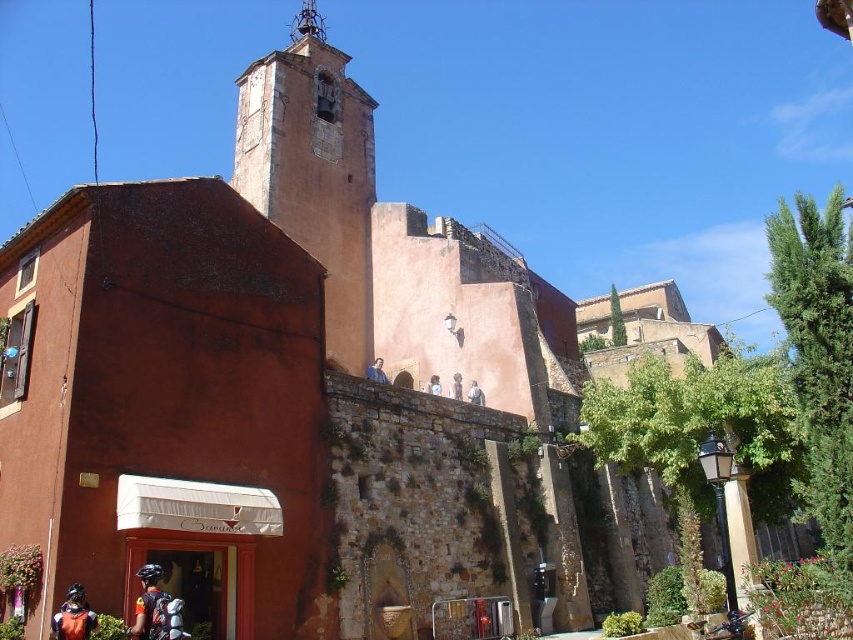
Based on the photo, you are standing at the entrance of the historic building and want to go to the point labeled point (x=287, y=61). Which direction should you move relative to point (x=151, y=630)?

Point (x=287, y=61) is behind point (x=151, y=630), so you should move in the direction away from point (x=151, y=630) to reach it.

You are standing in front of the historic European building and want to take a photo of the orange stucco tower at upper center. If you are exactly 156.41 feet away from it, will you be able to capture the entire tower in your camera frame without moving closer?

The orange stucco tower at upper center is 156.41 feet away from the viewer, so if your camera has a wide enough angle or zoom capability, you can capture the entire tower without moving closer. However, if your camera has a limited field of view, you might need to adjust your position or use a zoom lens.

You are standing at the entrance of the historic building and need to reach the shiny blue helmet at lower left and orange fabric helmet at lower left. Which helmet is closer to you?

The shiny blue helmet at lower left is closer to you since it is only 2.25 meters away from the orange fabric helmet at lower left, implying it is nearer to the entrance.